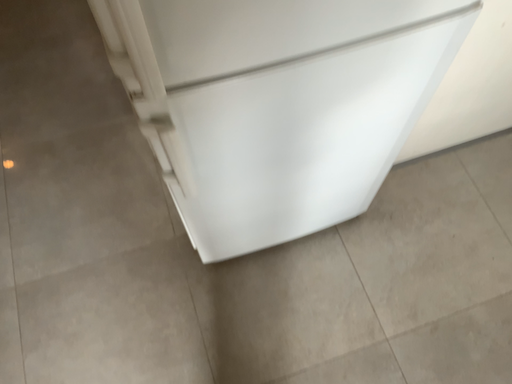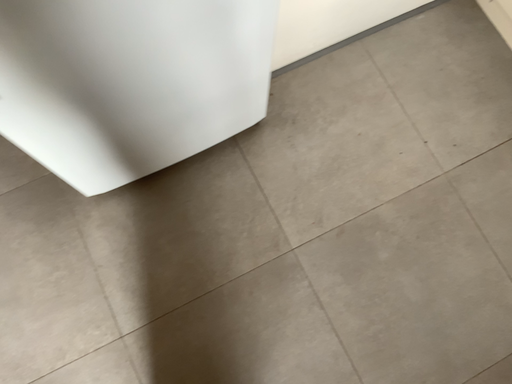
Question: Which way did the camera rotate in the video?

Choices:
 (A) rotated upward
 (B) rotated downward

Answer: (B)